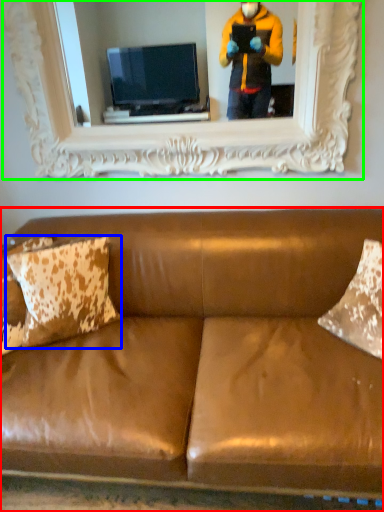
Question: Based on their relative distances, which object is nearer to studio couch (highlighted by a red box)? Choose from pillow (highlighted by a blue box) and picture frame (highlighted by a green box).

Choices:
 (A) pillow
 (B) picture frame

Answer: (A)